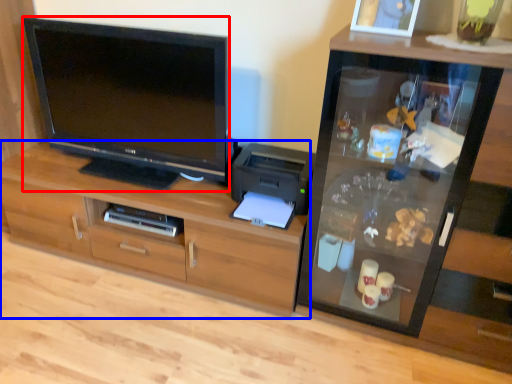
Question: Which object is further to the camera taking this photo, television (highlighted by a red box) or cabinetry (highlighted by a blue box)?

Choices:
 (A) television
 (B) cabinetry

Answer: (B)